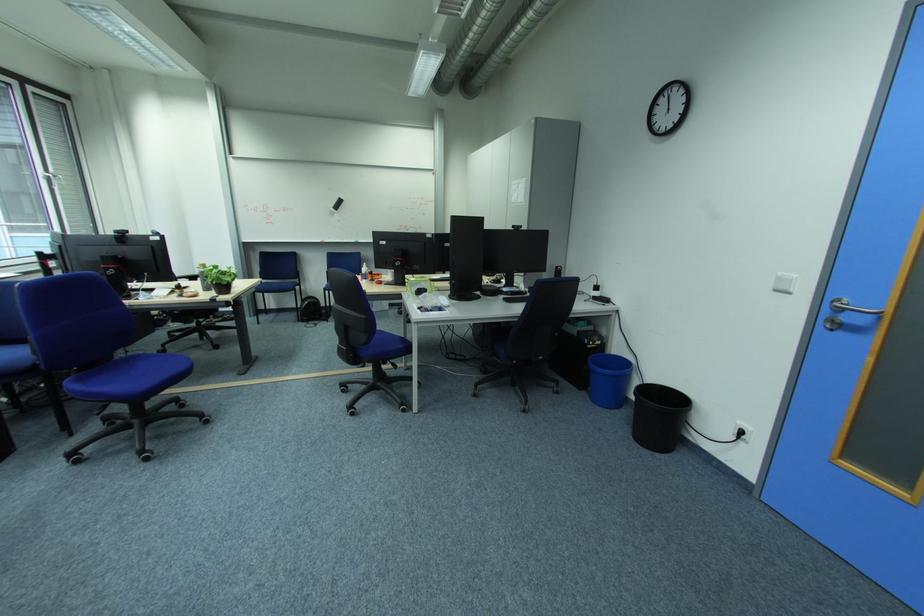
Where would you pull the silver door handle? Please return your answer as a coordinate pair (x, y).

(853, 309)